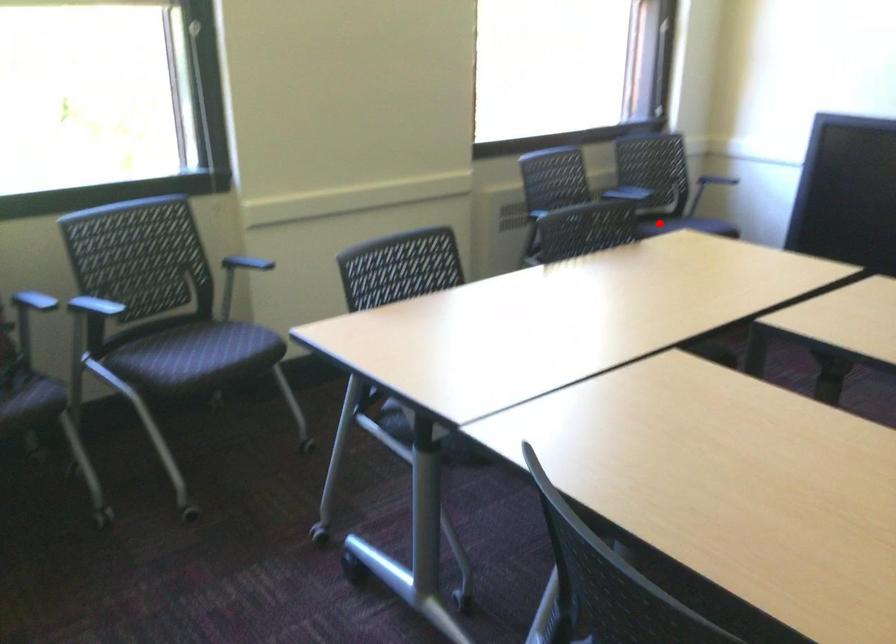
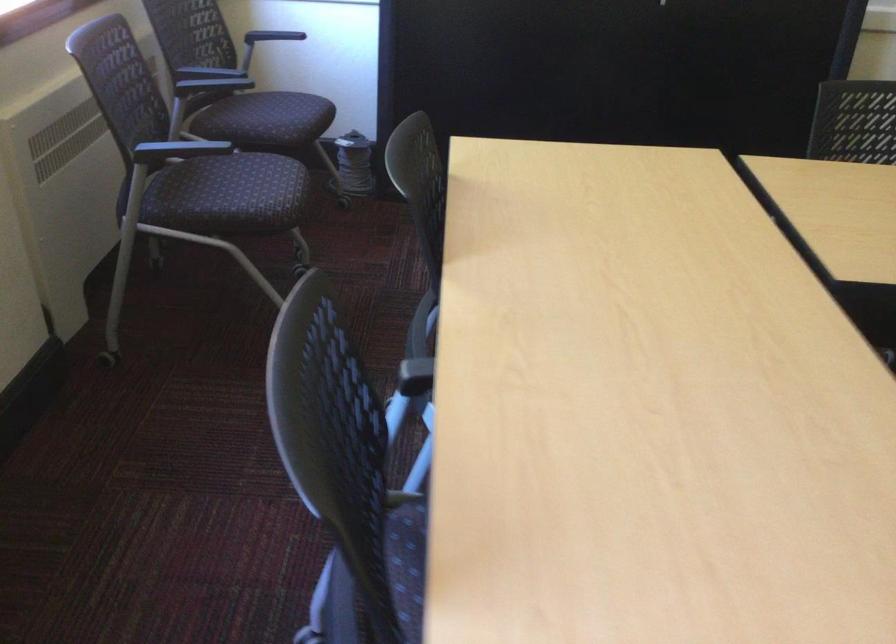
Question: I am providing you with two images of the same scene from different viewpoints. Image1 has a red point marked. In image2, the corresponding 3D location appears at what relative position? Reply with the corresponding letter.

Choices:
 (A) Closer
 (B) Farther

Answer: (A)